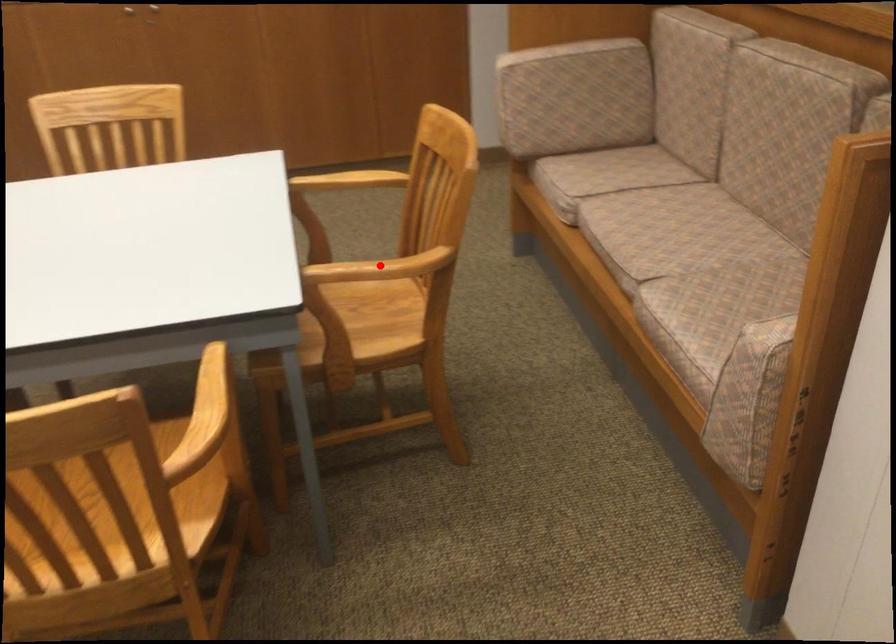
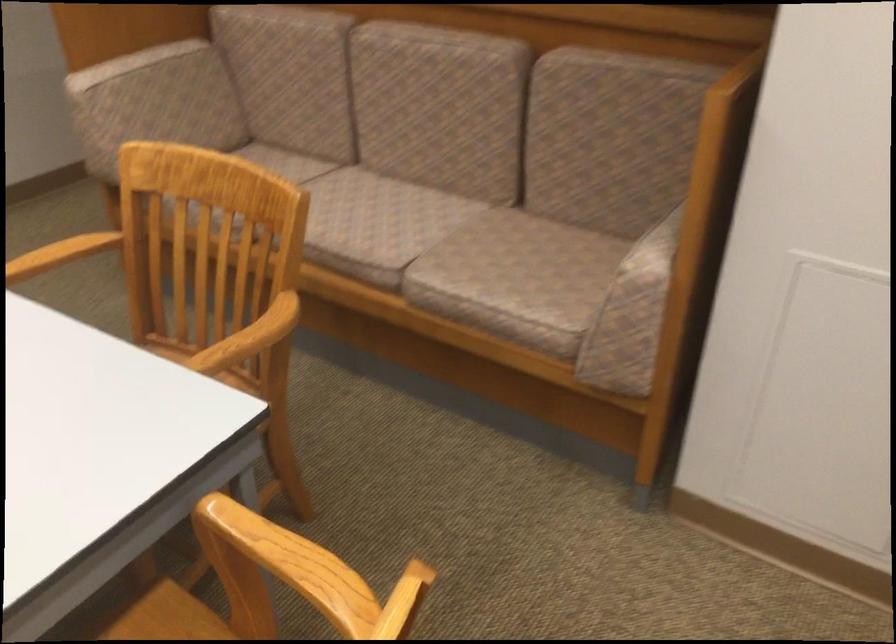
Question: A red point is marked in image1. In image2, is the corresponding 3D point closer to the camera or farther? Reply with the corresponding letter.

Choices:
 (A) The corresponding 3D point is closer.
 (B) The corresponding 3D point is farther.

Answer: (A)